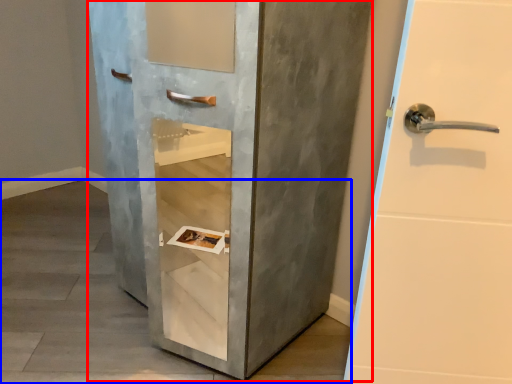
Question: Among these objects, which one is nearest to the camera, door (highlighted by a red box) or concrete (highlighted by a blue box)?

Choices:
 (A) door
 (B) concrete

Answer: (A)